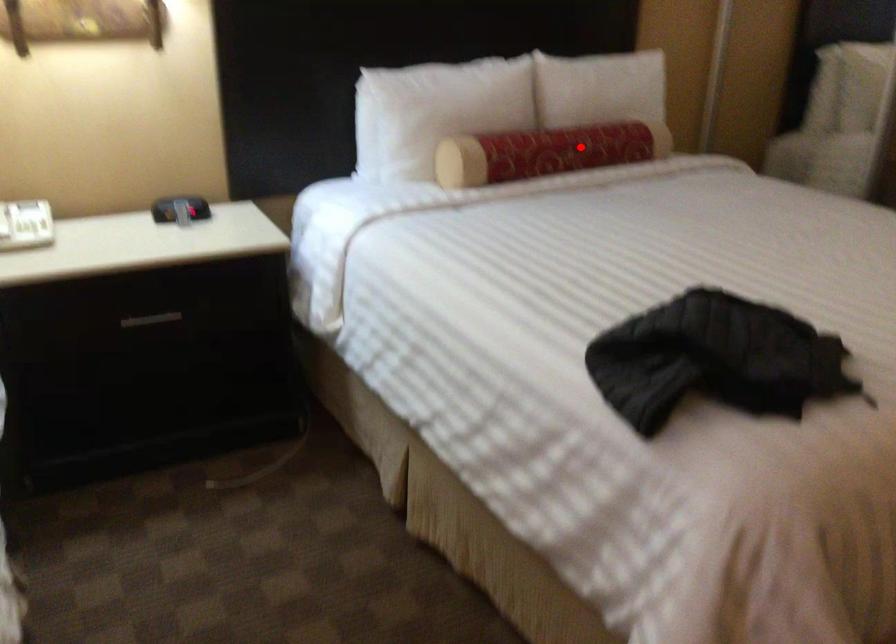
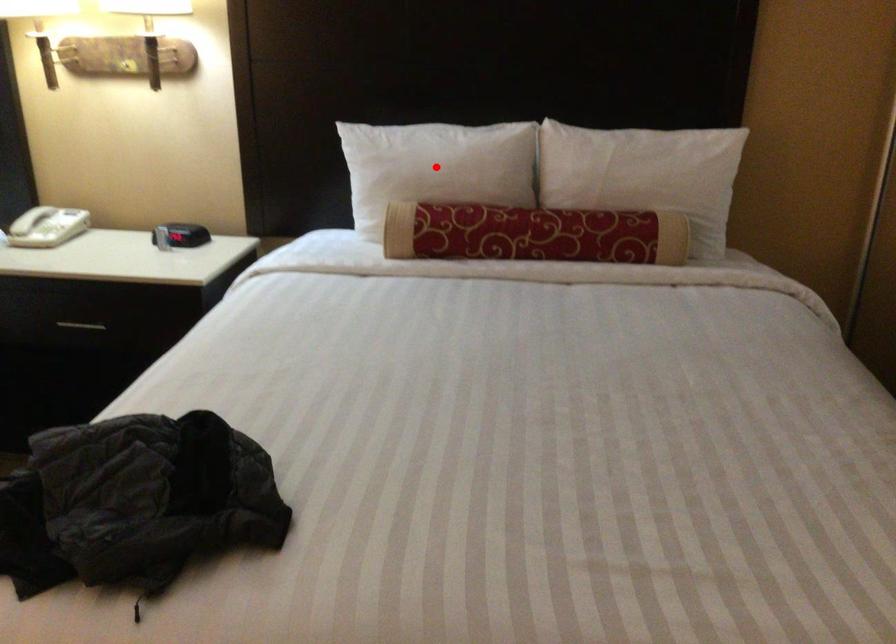
I am providing you with two images of the same scene from different viewpoints. A red point is marked on the first image and another point is marked on the second image. Is the red point in image1 aligned with the point shown in image2?

No